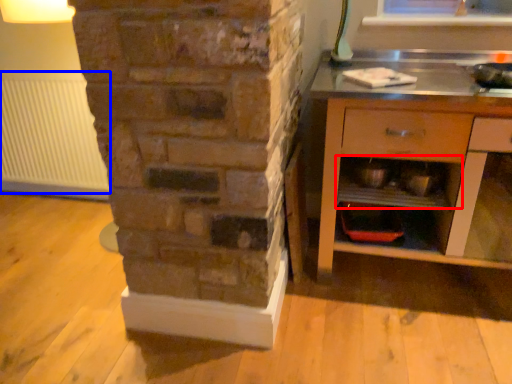
Question: Which object is closer to the camera taking this photo, shelf (highlighted by a red box) or radiator (highlighted by a blue box)?

Choices:
 (A) shelf
 (B) radiator

Answer: (A)